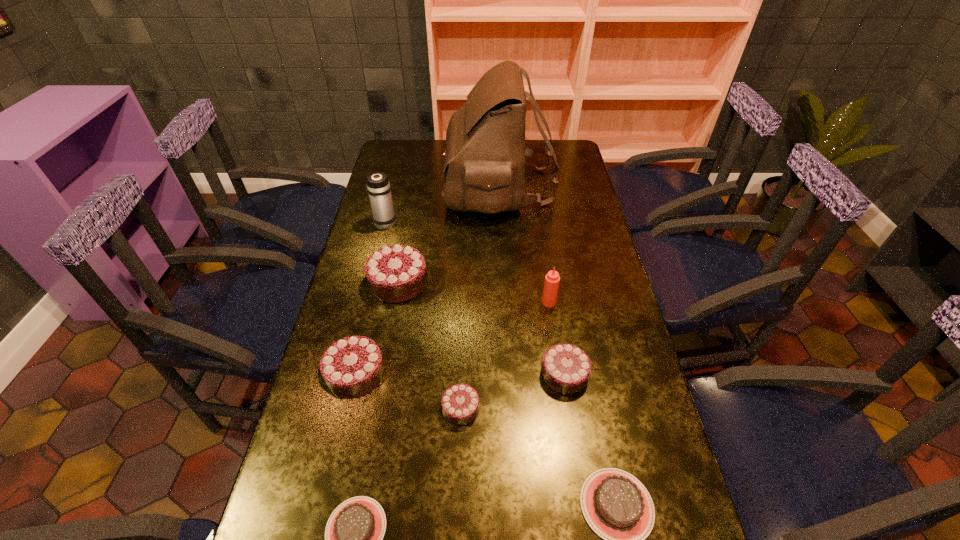
The image size is (960, 540). In order to click on satchel in this screenshot , I will do `click(487, 539)`.

Identify the location of brown satchel. Image resolution: width=960 pixels, height=540 pixels. (487, 539).

Where is `thermos bottle`? The width and height of the screenshot is (960, 540). thermos bottle is located at coordinates (487, 539).

Locate an element on the screen. The image size is (960, 540). Tabasco sauce is located at coordinates (487, 539).

You are a GUI agent. You are given a task and a screenshot of the screen. Output one action in this format:
    pyautogui.click(x=<x>, y=<y>)
    Task: Click on the biggest chocolate chocolate cake
    The image size is (960, 540).
    Given the screenshot: What is the action you would take?
    pyautogui.click(x=487, y=539)

Identify the location of the fourth tallest object. (487, 539).

Where is `the second biggest chocolate chocolate cake`? The image size is (960, 540). the second biggest chocolate chocolate cake is located at coordinates (487, 539).

I want to click on the fifth tallest object, so click(487, 539).

Where is `the fourth shortest chocolate cake`? the fourth shortest chocolate cake is located at coordinates (487, 539).

I want to click on the fourth shortest object, so click(x=487, y=539).